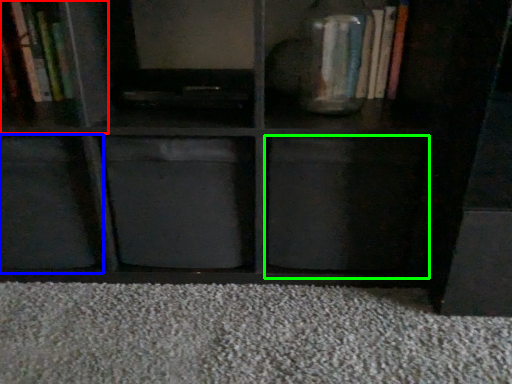
Question: Which is farther away from cabinet (highlighted by a red box)? cabinet (highlighted by a blue box) or drawer (highlighted by a green box)?

Choices:
 (A) cabinet
 (B) drawer

Answer: (B)